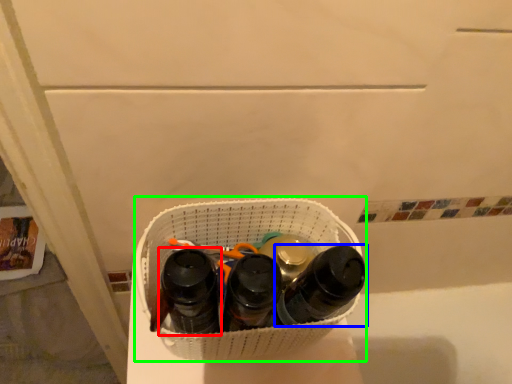
Question: Based on their relative distances, which object is nearer to footwear (highlighted by a red box)? Choose from footwear (highlighted by a blue box) and laundry basket (highlighted by a green box).

Choices:
 (A) footwear
 (B) laundry basket

Answer: (B)